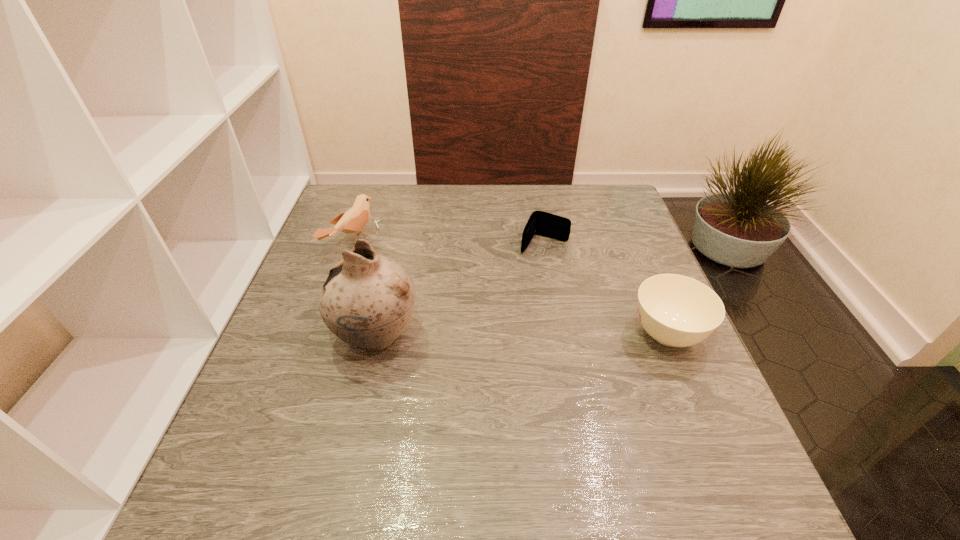
At what (x,y) coordinates should I click in order to perform the action: click on pottery. Please return your answer as a coordinate pair (x, y). This screenshot has height=540, width=960. Looking at the image, I should click on (367, 300).

Find the location of a particular element. the rightmost object is located at coordinates (675, 310).

I want to click on bird, so click(352, 221).

The width and height of the screenshot is (960, 540). Find the location of `wallet`. wallet is located at coordinates (541, 223).

You are a GUI agent. You are given a task and a screenshot of the screen. Output one action in this format:
    pyautogui.click(x=<x>, y=<y>)
    Task: Click on the shortest object
    This screenshot has height=540, width=960.
    Given the screenshot: What is the action you would take?
    pyautogui.click(x=541, y=223)

What are the coordinates of `vacant space located from the spout of the pottery` in the screenshot? It's located at (278, 335).

You are a GUI agent. You are given a task and a screenshot of the screen. Output one action in this format:
    pyautogui.click(x=<x>, y=<y>)
    Task: Click on the vacant space positioned 0.110m from the spout of the pottery
    The height and width of the screenshot is (540, 960).
    Given the screenshot: What is the action you would take?
    pyautogui.click(x=283, y=335)

At what (x,y) coordinates should I click in order to perform the action: click on free location located 0.110m from the spout of the pottery. Please return your answer as a coordinate pair (x, y). Image resolution: width=960 pixels, height=540 pixels. Looking at the image, I should click on (283, 335).

Image resolution: width=960 pixels, height=540 pixels. Identify the location of free region located 0.100m on the back of the rightmost object. (644, 279).

I want to click on vacant space located 0.180m at the beak of the bird, so pos(421,277).